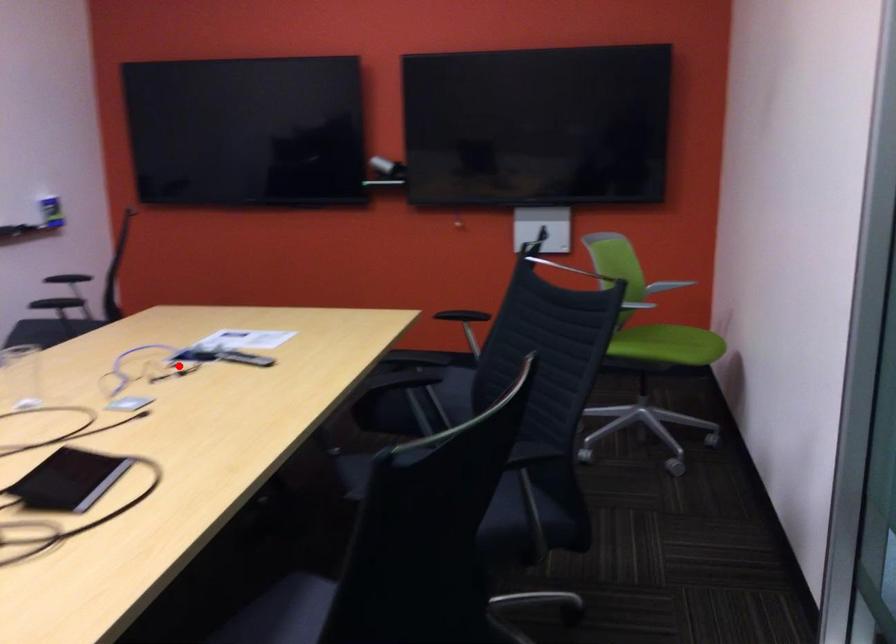
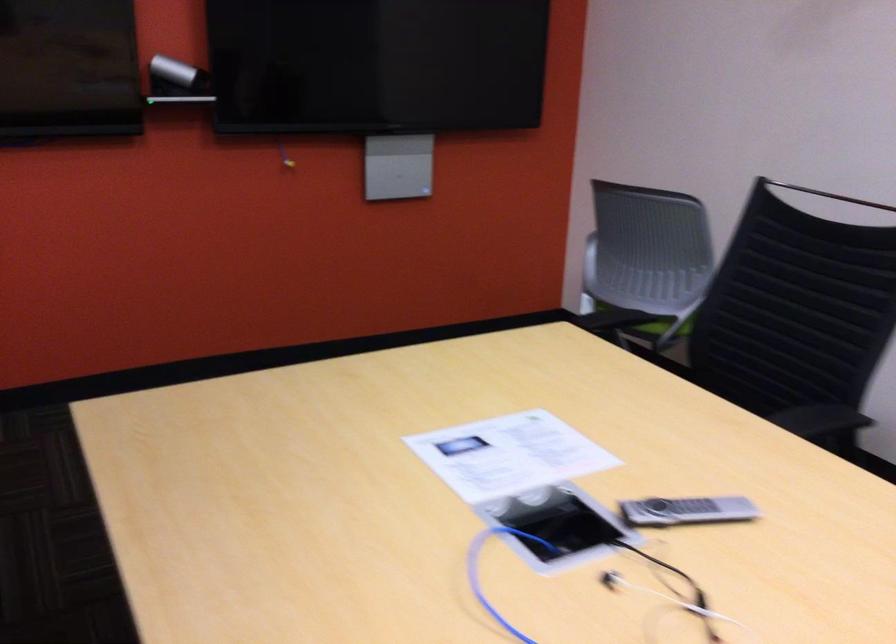
The point at the highlighted location is marked in the first image. Where is the corresponding point in the second image?

(576, 583)